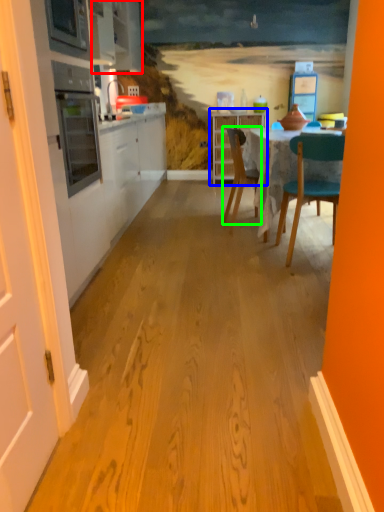
Question: Estimate the real-world distances between objects in this image. Which object is farther from cabinetry (highlighted by a red box), cabinetry (highlighted by a blue box) or chair (highlighted by a green box)?

Choices:
 (A) cabinetry
 (B) chair

Answer: (A)